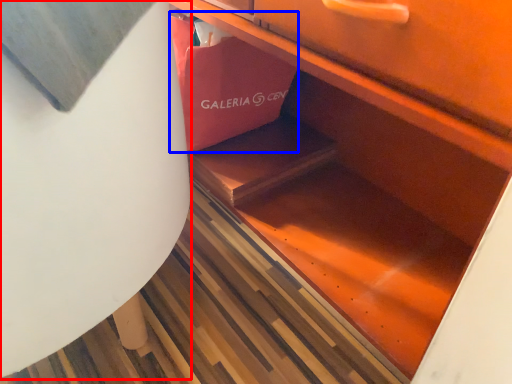
Question: Among these objects, which one is nearest to the camera, round table (highlighted by a red box) or shopping bag (highlighted by a blue box)?

Choices:
 (A) round table
 (B) shopping bag

Answer: (A)